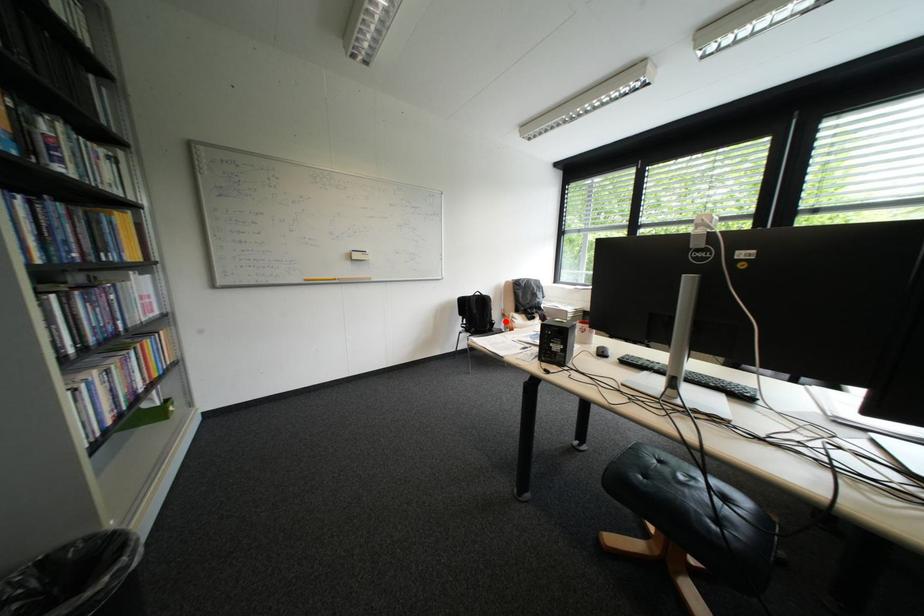
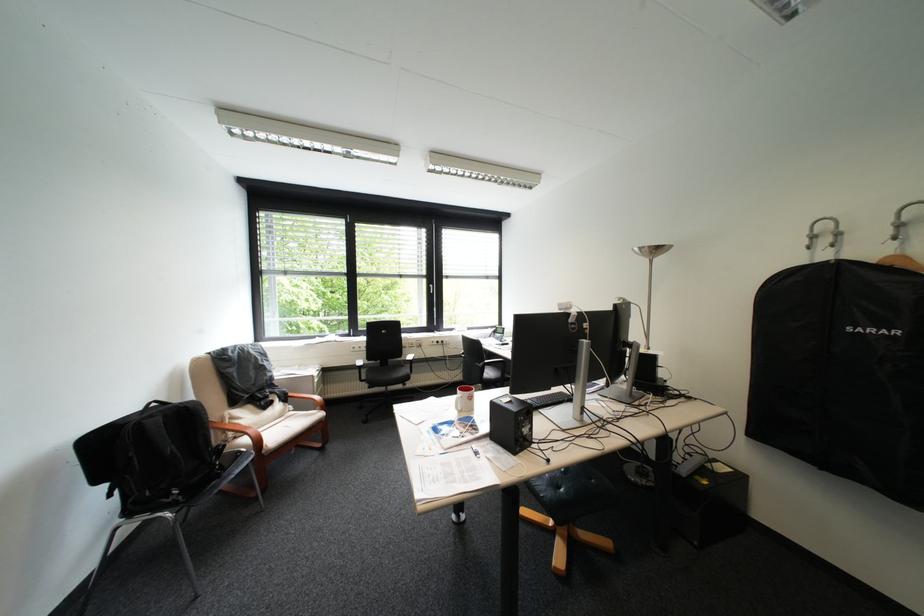
The point at the highlighted location is marked in the first image. Where is the corresponding point in the second image?

(231, 445)